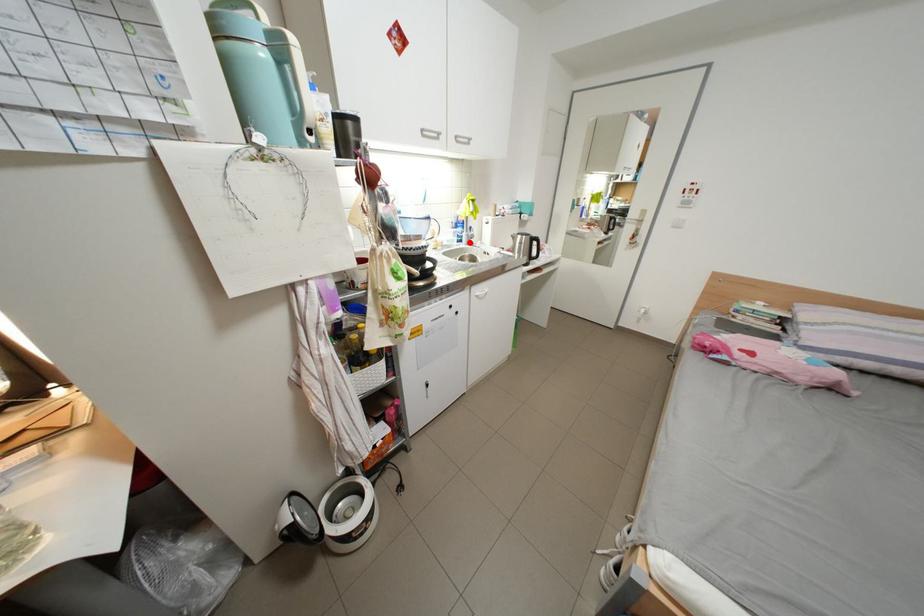
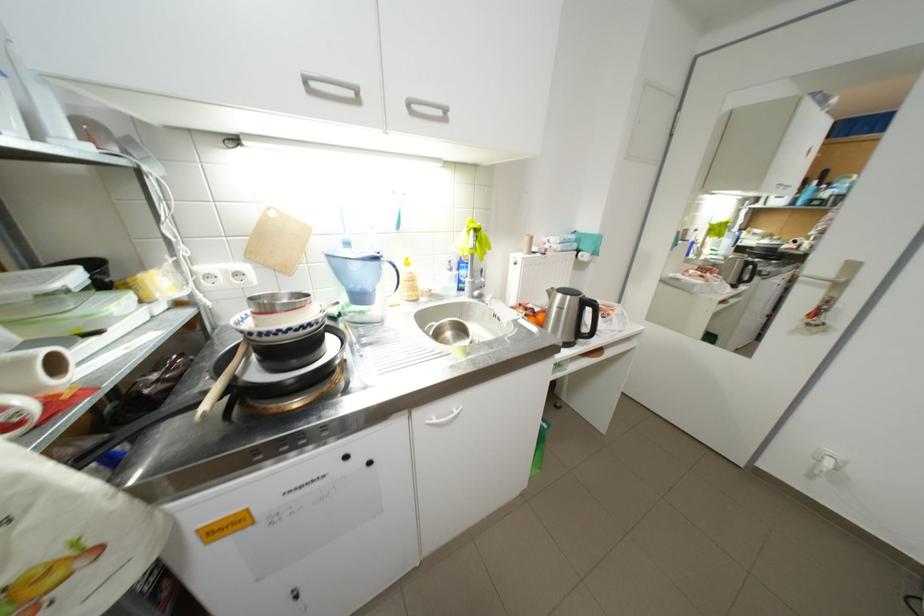
The point at the highlighted location is marked in the first image. Where is the corresponding point in the second image?

(471, 291)